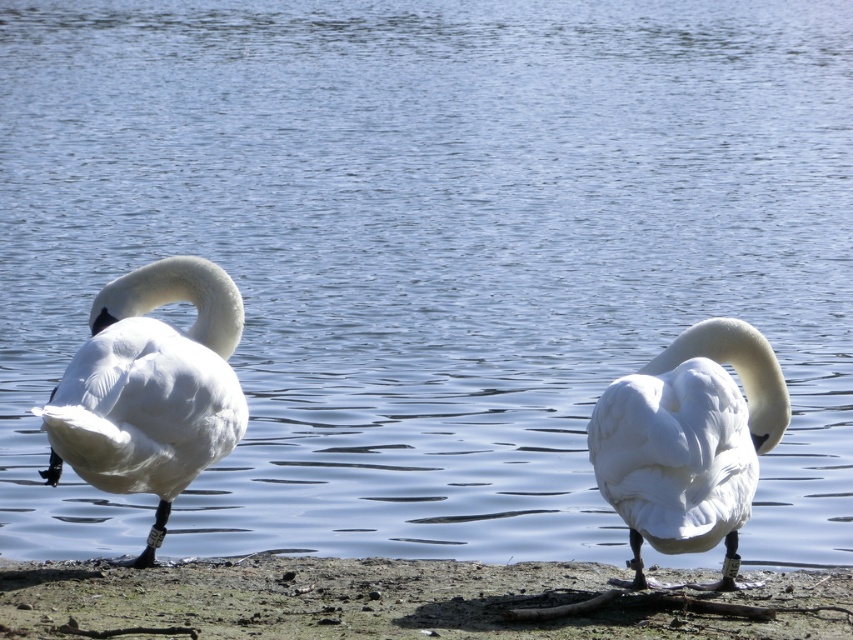
You are a photographer trying to capture the white feathered swan at left and the muddy sand at lower center in the same frame. Given the size difference between them, which one would you need to zoom in on more to make them appear similar in size in your photo?

The muddy sand at lower center has a larger size compared to the white feathered swan at left. To make them appear similar in size in the photo, you would need to zoom in more on the white feathered swan at left since it is smaller and requires magnification to match the size of the muddy sand at lower center in the frame.